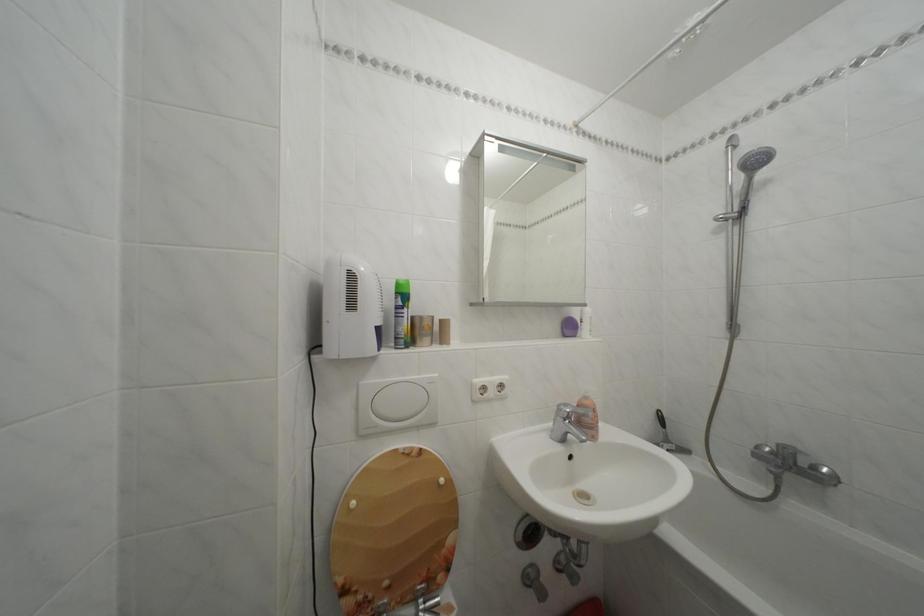
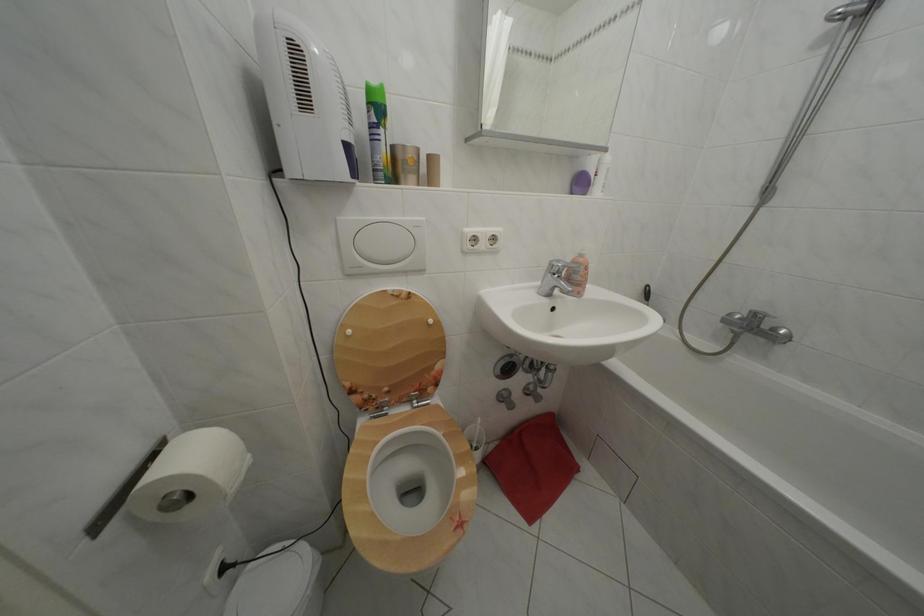
Which direction would the cameraman need to move to produce the second image?

The cameraman moved toward right, forward.